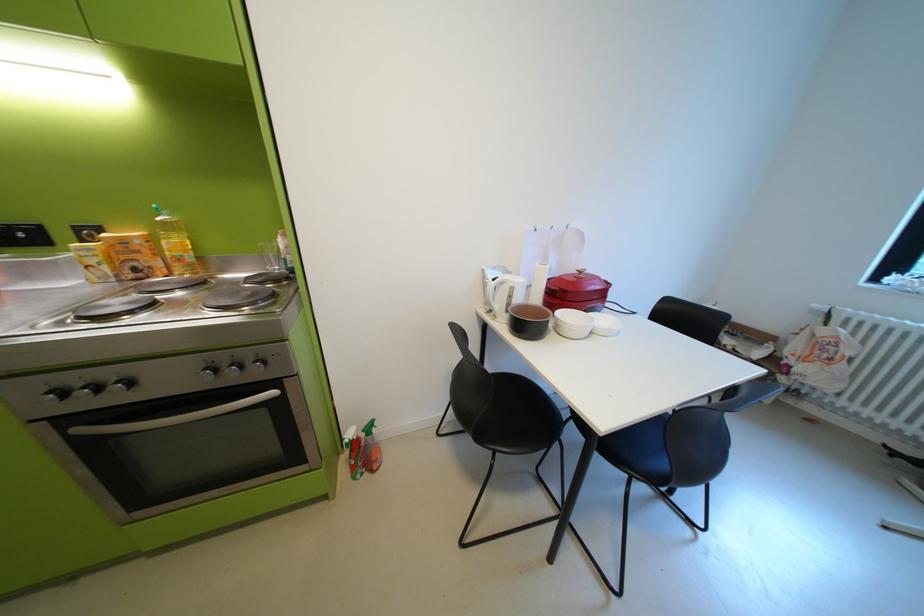
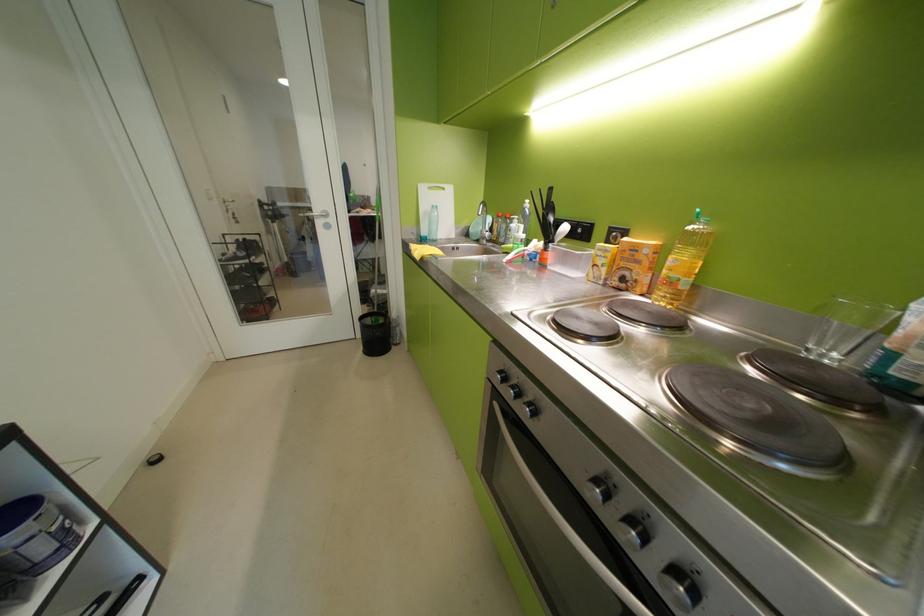
Where in the second image is the point corresponding to point 286,270 from the first image?

(843, 358)